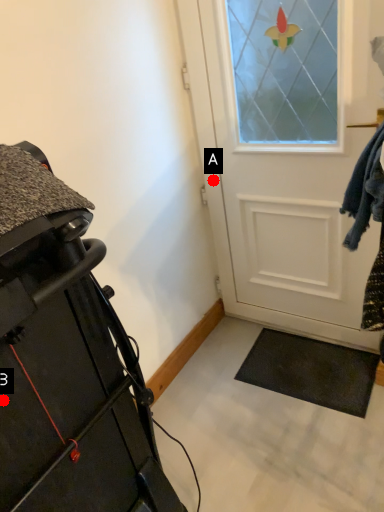
Question: Two points are circled on the image, labeled by A and B beside each circle. Which point is closer to the camera?

Choices:
 (A) A is closer
 (B) B is closer

Answer: (B)